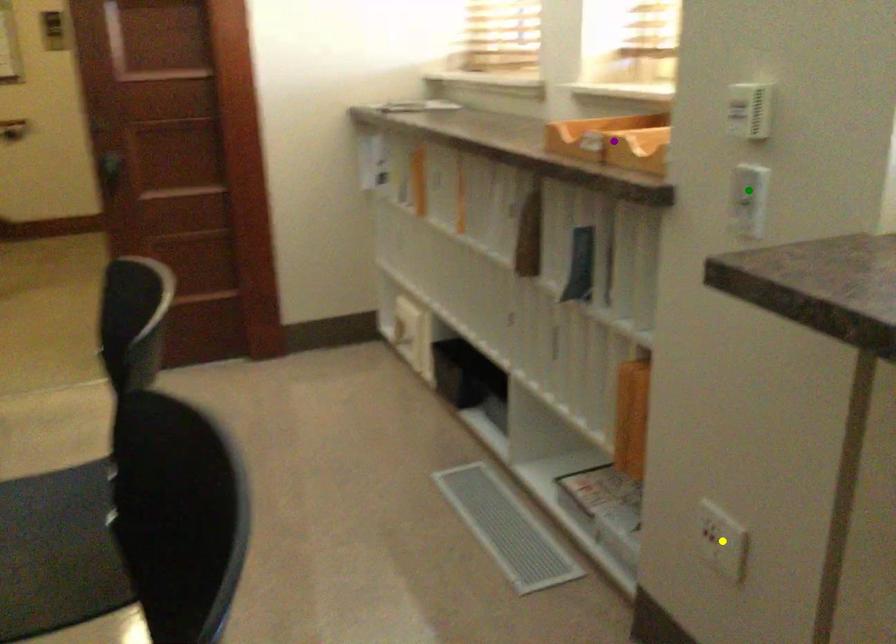
Order these from nearest to farthest:
yellow point
purple point
green point

green point → yellow point → purple point